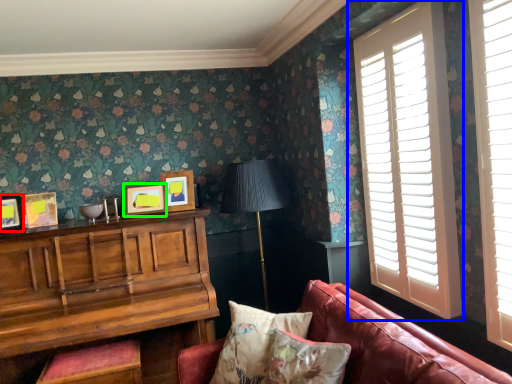
Question: Estimate the real-world distances between objects in this image. Which object is farther from picture frame (highlighted by a red box), window (highlighted by a blue box) or picture frame (highlighted by a green box)?

Choices:
 (A) window
 (B) picture frame

Answer: (A)